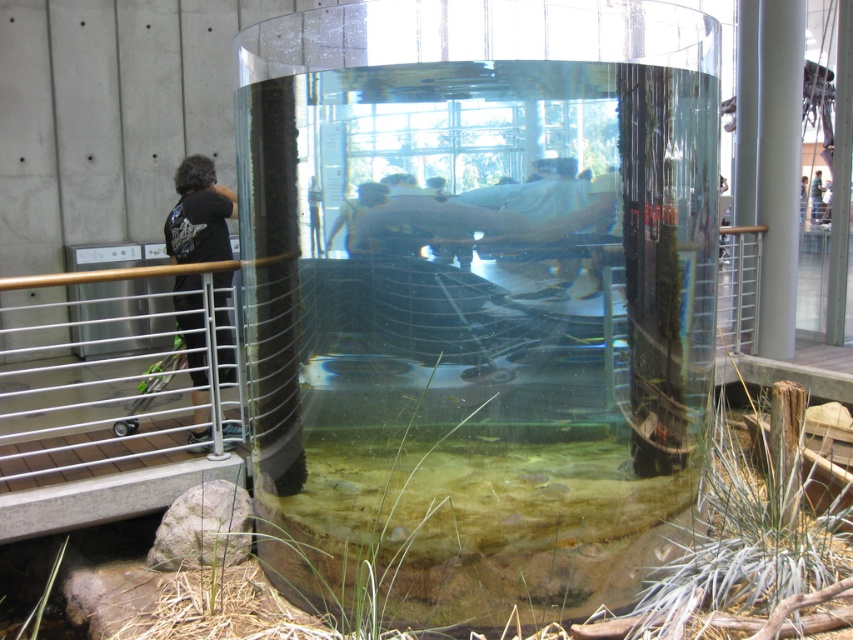
In the scene shown: You are a visitor standing in front of the clear glass water tank at center and the matte black shirt at center. Which object is wider?

The clear glass water tank at center is wider than the matte black shirt at center.

You are standing in front of the aquarium and want to take a photo of the black fabric shirt at left without any obstructions. Since the shirt is 15.33 feet away from you, is it possible to capture it clearly in your photo?

The black fabric shirt at left is 15.33 feet away from the camera, so it is possible to capture it clearly in the photo as long as the camera has sufficient zoom or the subject is within the camera sensor range.

You are an assistant helping to organize a clothing display. You have two shirts in front of you, the matte black shirt at center and the light blue shirt at upper center. Which shirt is narrower in width?

The matte black shirt at center has a lesser width compared to the light blue shirt at upper center, so the matte black shirt at center is narrower.